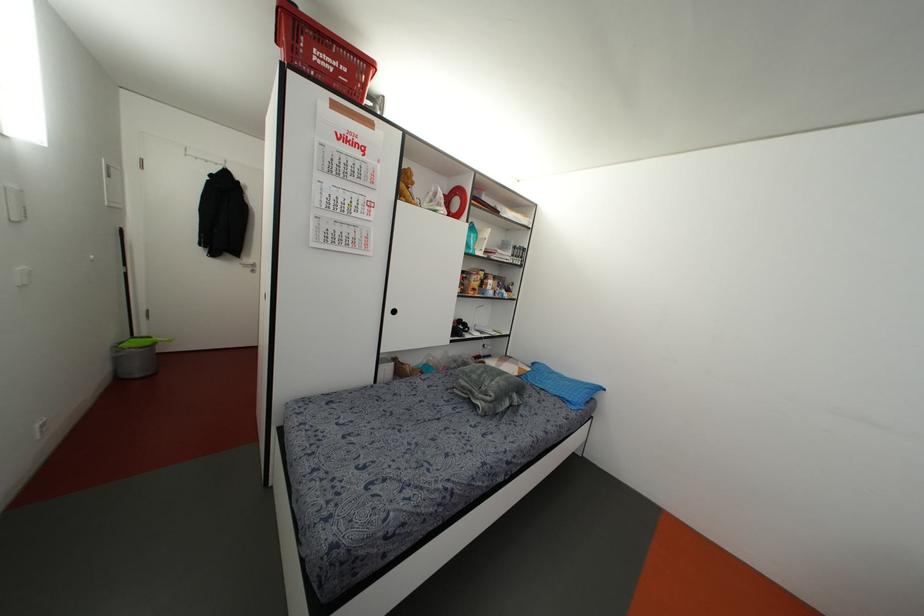
At what (x,y) coordinates should I click in order to perform the action: click on white light switch. Please return your answer as a coordinate pair (x, y). Looking at the image, I should click on (112, 185).